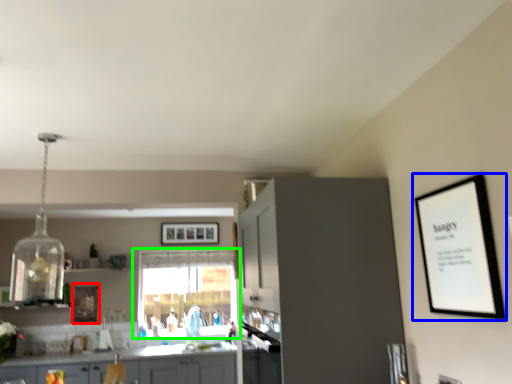
Question: Considering the real-world distances, which object is closest to picture frame (highlighted by a red box)? picture frame (highlighted by a blue box) or window (highlighted by a green box).

Choices:
 (A) picture frame
 (B) window

Answer: (B)